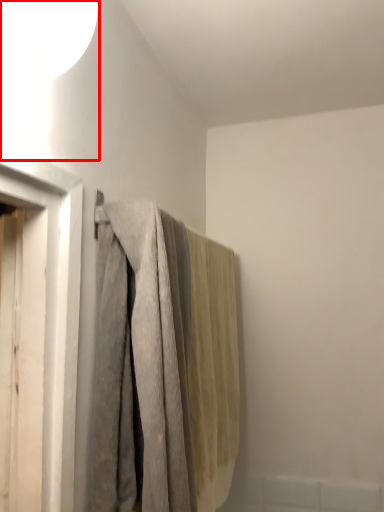
Question: From the image's perspective, where is lamp (annotated by the red box) located relative to curtain?

Choices:
 (A) below
 (B) above

Answer: (B)